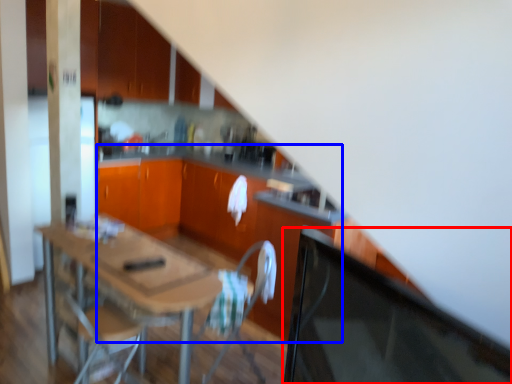
Question: Which point is closer to the camera, computer monitor (highlighted by a red box) or computer desk (highlighted by a blue box)?

Choices:
 (A) computer monitor
 (B) computer desk

Answer: (A)